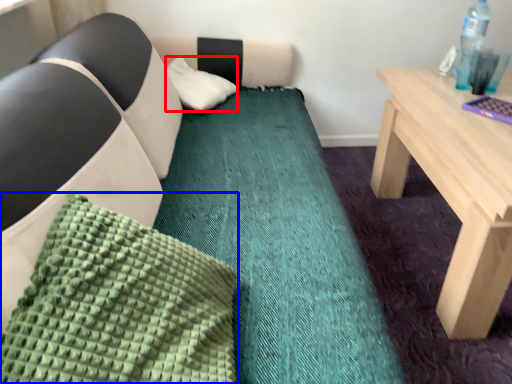
Question: Which object appears farthest to the camera in this image, pillow (highlighted by a red box) or pillow (highlighted by a blue box)?

Choices:
 (A) pillow
 (B) pillow

Answer: (A)